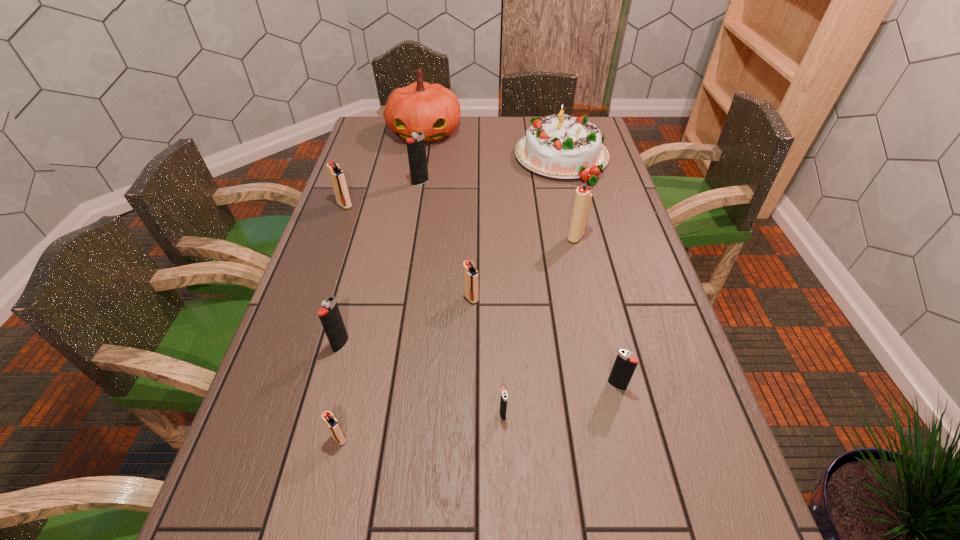
Where is `the second igniter from left to right`? Image resolution: width=960 pixels, height=540 pixels. the second igniter from left to right is located at coordinates (330, 317).

Find the location of a particular element. The height and width of the screenshot is (540, 960). the sixth farthest igniter is located at coordinates (625, 364).

Locate an element on the screen. This screenshot has height=540, width=960. the rightmost black igniter is located at coordinates (625, 364).

This screenshot has width=960, height=540. I want to click on the fifth igniter from left to right, so click(471, 276).

Identify the location of the second nearest red igniter. (471, 276).

Where is `the second red igniter from left to right`? the second red igniter from left to right is located at coordinates (331, 422).

Locate an element on the screen. the nearest object is located at coordinates (331, 422).

Image resolution: width=960 pixels, height=540 pixels. I want to click on the nearest black igniter, so click(x=504, y=394).

Find the location of a particular element. The height and width of the screenshot is (540, 960). the second black igniter from right to left is located at coordinates (504, 394).

I want to click on free spot located 0.170m on the front-facing side of the pumpkin, so click(417, 177).